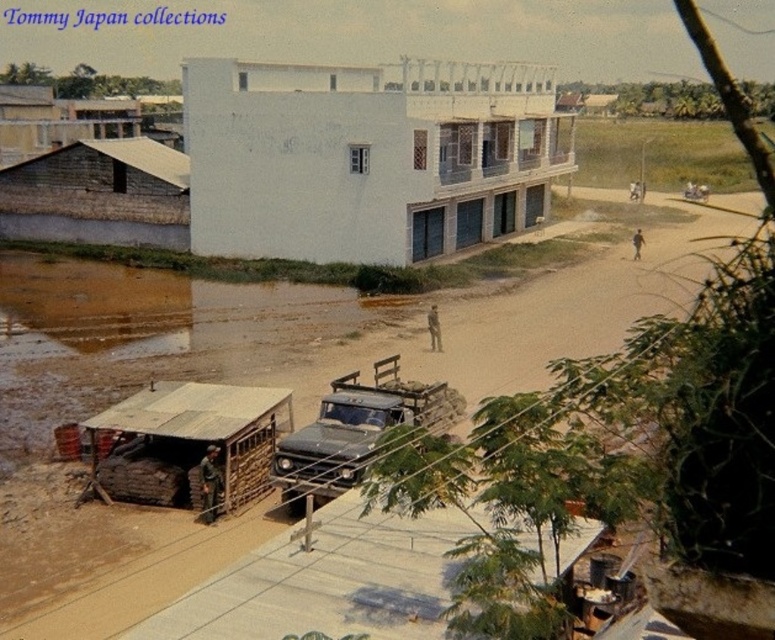
Can you confirm if brown dirt track at center is smaller than white smooth building at center?

No.

Is brown dirt track at center behind white smooth building at center?

No, it is in front of white smooth building at center.

Is point (698, 243) in front of point (400, 211)?

No, (698, 243) is further to viewer.

At what (x,y) coordinates should I click in order to perform the action: click on brown dirt track at center. Please return your answer as a coordinate pair (x, y). This screenshot has height=640, width=775. Looking at the image, I should click on (418, 323).

You are a GUI agent. You are given a task and a screenshot of the screen. Output one action in this format:
    pyautogui.click(x=<x>, y=<y>)
    Task: Click on the white smooth building at center
    This screenshot has width=775, height=640.
    Given the screenshot: What is the action you would take?
    pyautogui.click(x=367, y=156)

Which of these two, white smooth building at center or wooden shingles hut at upper left, stands taller?

wooden shingles hut at upper left

Between point (477, 198) and point (131, 102), which one is positioned in front?

Point (477, 198) is in front.

Identify the location of white smooth building at center. (367, 156).

Does white smooth building at center have a lesser height compared to wooden hut at left?

Incorrect, white smooth building at center's height does not fall short of wooden hut at left's.

Is white smooth building at center closer to the viewer compared to wooden hut at left?

Yes, white smooth building at center is in front of wooden hut at left.

Identify the location of white smooth building at center. (367, 156).